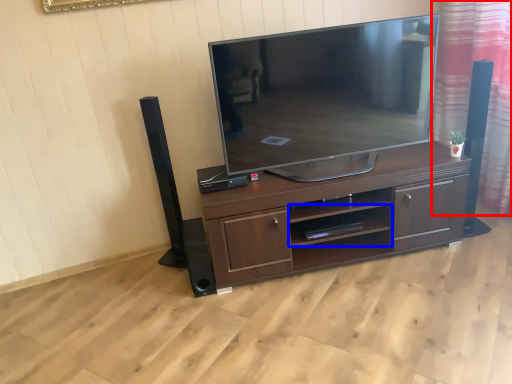
Question: Which point is closer to the camera, curtain (highlighted by a red box) or shelf (highlighted by a blue box)?

Choices:
 (A) curtain
 (B) shelf

Answer: (A)